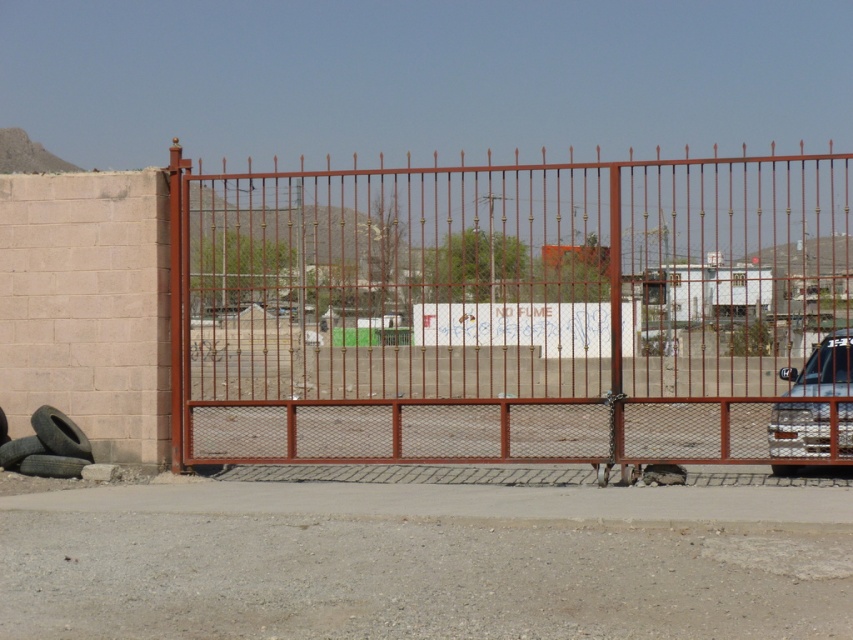
Can you confirm if metallic silver car at right is taller than black rubber tire at lower left?

Yes, metallic silver car at right is taller than black rubber tire at lower left.

You are a GUI agent. You are given a task and a screenshot of the screen. Output one action in this format:
    pyautogui.click(x=<x>, y=<y>)
    Task: Click on the metallic silver car at right
    Image resolution: width=853 pixels, height=640 pixels.
    Given the screenshot: What is the action you would take?
    pyautogui.click(x=809, y=429)

At what (x,y) coordinates should I click in order to perform the action: click on metallic silver car at right. Please return your answer as a coordinate pair (x, y). This screenshot has height=640, width=853. Looking at the image, I should click on (809, 429).

Who is more distant from viewer, (x=846, y=369) or (x=838, y=438)?

Point (x=846, y=369)

Is rusty metal gate at center positioned behind metallic silver car at right?

No, it is in front of metallic silver car at right.

What do you see at coordinates (515, 312) in the screenshot? I see `rusty metal gate at center` at bounding box center [515, 312].

You are a GUI agent. You are given a task and a screenshot of the screen. Output one action in this format:
    pyautogui.click(x=<x>, y=<y>)
    Task: Click on the rusty metal gate at center
    This screenshot has width=853, height=640.
    Given the screenshot: What is the action you would take?
    515,312

Is rusty metal gate at center further to the viewer compared to black rubber tire at lower left?

No, rusty metal gate at center is in front of black rubber tire at lower left.

Based on the photo, is rusty metal gate at center above black rubber tire at lower left?

Yes.

Who is more distant from viewer, (357,426) or (59,422)?

The point (357,426) is more distant.

Where is `rusty metal gate at center`? This screenshot has height=640, width=853. rusty metal gate at center is located at coordinates (515, 312).